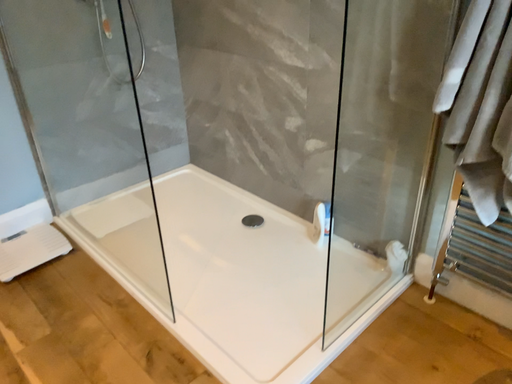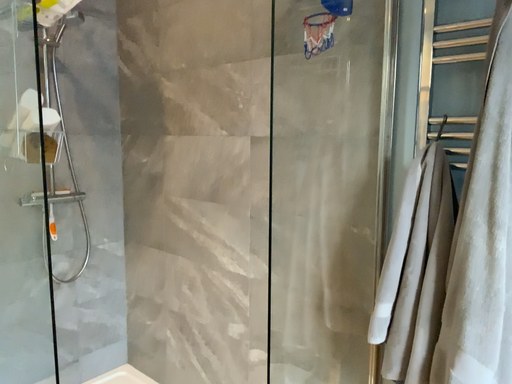
Question: Which way did the camera rotate in the video?

Choices:
 (A) rotated downward
 (B) rotated upward

Answer: (B)